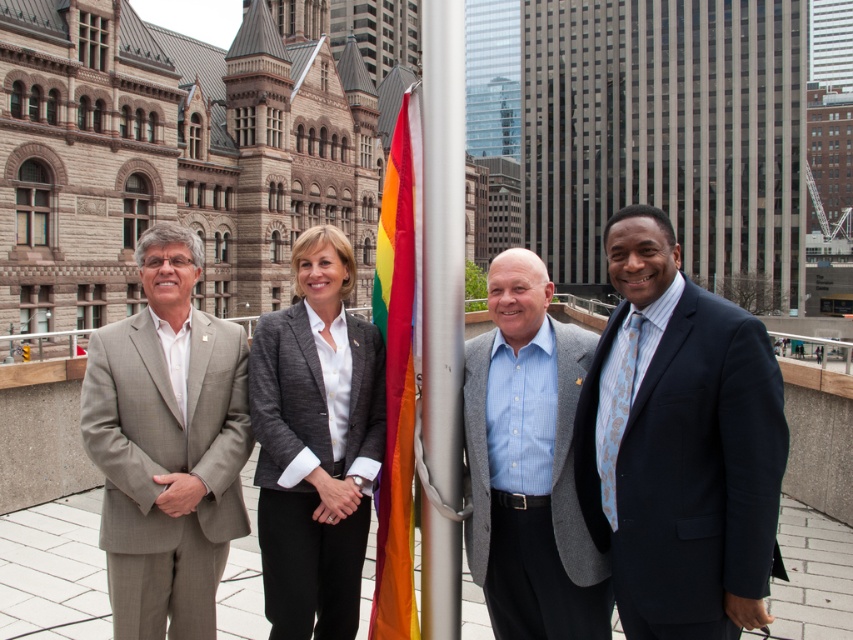
From the picture: You are a photographer positioned in front of the historic building and modern skyscrapers. You need to capture a photo of the gray wool suit at center without the brushed metal flag pole at center appearing in the background. Is this possible given their current positions?

The brushed metal flag pole at center is behind the gray wool suit at center, so if positioned correctly, the photographer can take a photo where the gray wool suit at center blocks the view of the flag pole, making it invisible in the final image.

You are taking a photo of the four people standing in front of the historic building and modern skyscrapers. You notice two points marked in the image at coordinates point (165, 292) and point (260, 548). Which of these two points is closer to the camera?

Point (165, 292) is further to the camera than point (260, 548), so the point closer to the camera is point (260, 548).

You are a photographer planning to take a group photo of the four individuals in front of the historic building and modern skyscrapers. You need to ensure that the gray wool suit at center is positioned exactly at the point marked by coordinates (x=529, y=465). Can you confirm if this point is correctly placed on the gray wool suit at center?

Yes, according to the provided description, the point (x=529, y=465) corresponds to the gray wool suit at center, so the placement is correct.